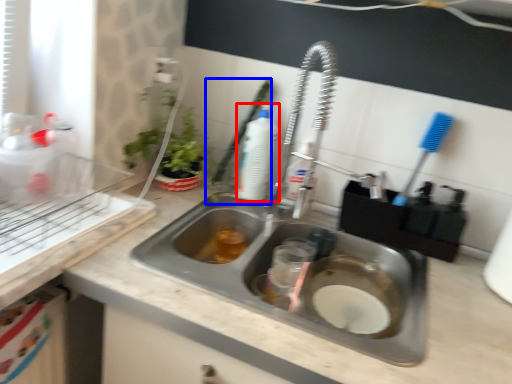
Question: Which of the following is the closest to the observer, cleaning product (highlighted by a red box) or brush (highlighted by a blue box)?

Choices:
 (A) cleaning product
 (B) brush

Answer: (B)